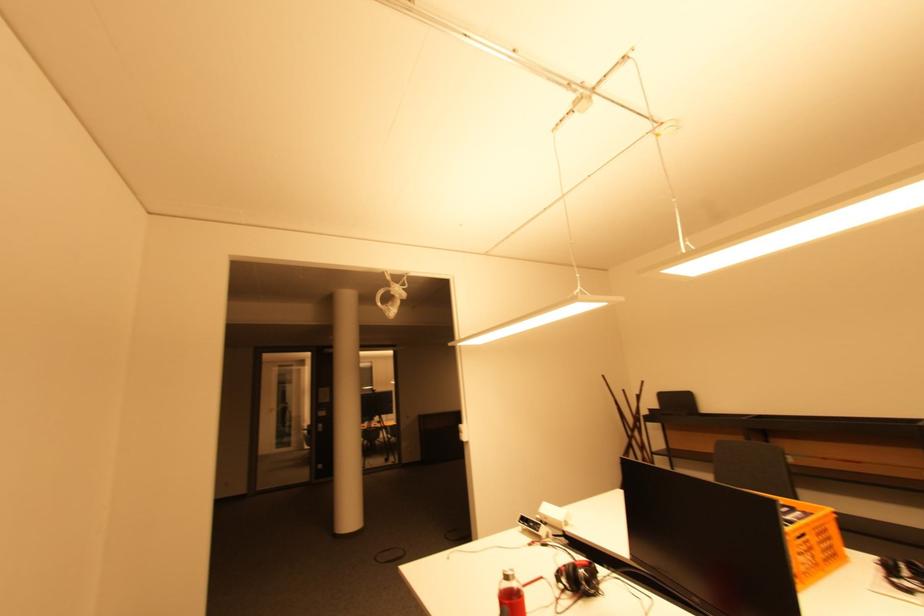
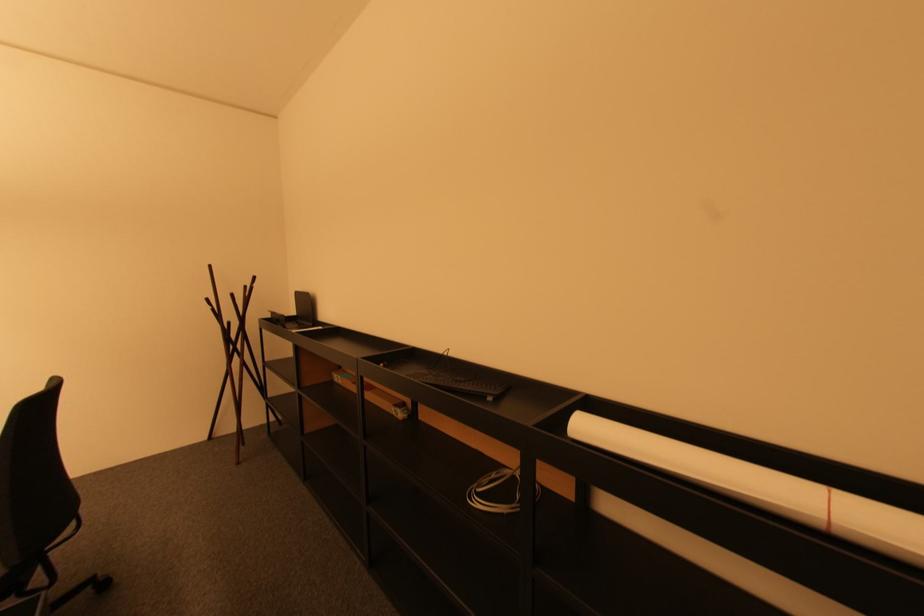
Question: Which direction would the cameraman need to move to produce the second image? Reply with the corresponding letter.

Choices:
 (A) Left
 (B) Right
 (C) Forward
 (D) Backward

Answer: (B)